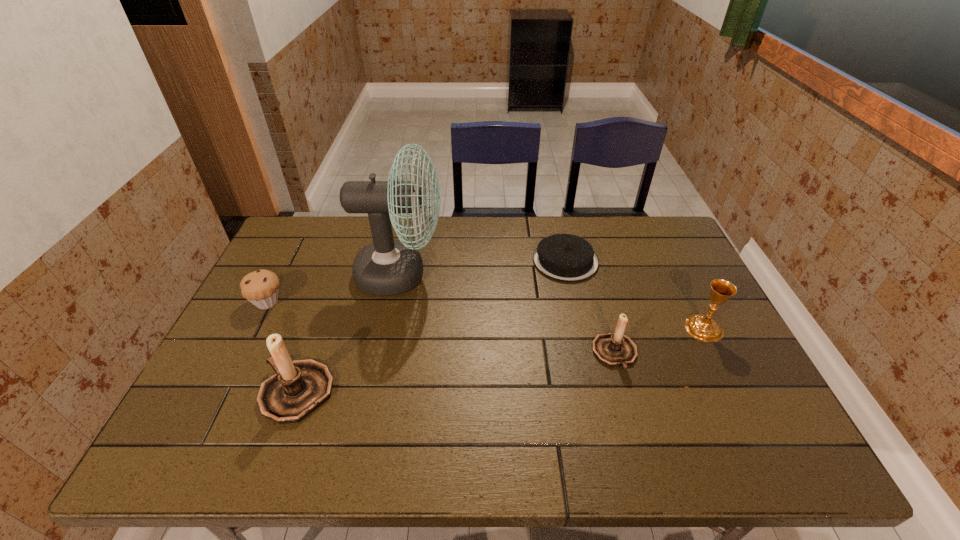
You are a GUI agent. You are given a task and a screenshot of the screen. Output one action in this format:
    pyautogui.click(x=<x>, y=<y>)
    Task: Click on the vacant area between the fan and the taller candle holder
    The width and height of the screenshot is (960, 540).
    Given the screenshot: What is the action you would take?
    pyautogui.click(x=348, y=333)

I want to click on free space between the fifth shortest object and the shorter candle holder, so click(456, 373).

Where is `vacant space in between the tallest object and the pancake`? Image resolution: width=960 pixels, height=540 pixels. vacant space in between the tallest object and the pancake is located at coordinates click(483, 268).

The width and height of the screenshot is (960, 540). What are the coordinates of `unoccupied area between the rightmost object and the fan` in the screenshot? It's located at (552, 301).

I want to click on free space between the shortest object and the fan, so click(483, 268).

I want to click on vacant point located between the taller candle holder and the chalice, so click(500, 360).

Select which object is the closest to the muffin. Please provide its 2D coordinates. Your answer should be formatted as a tuple, i.e. [(x, y)], where the tuple contains the x and y coordinates of a point satisfying the conditions above.

[(299, 387)]

At what (x,y) coordinates should I click in order to perform the action: click on object that is the nearest to the muffin. Please return your answer as a coordinate pair (x, y). Image resolution: width=960 pixels, height=540 pixels. Looking at the image, I should click on (299, 387).

Image resolution: width=960 pixels, height=540 pixels. What are the coordinates of `vacant point that satisfies the following two spatial constraints: 1. in front of the fan where the airflow is directed; 2. on the right side of the rightmost object` in the screenshot? It's located at (389, 328).

At what (x,y) coordinates should I click in order to perform the action: click on free location that satisfies the following two spatial constraints: 1. on the back side of the pancake; 2. on the left side of the muffin. Please return your answer as a coordinate pair (x, y). Looking at the image, I should click on (287, 261).